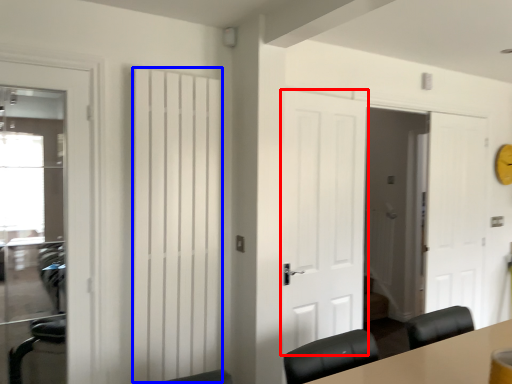
Question: Which object is further to the camera taking this photo, door (highlighted by a red box) or curtain (highlighted by a blue box)?

Choices:
 (A) door
 (B) curtain

Answer: (A)